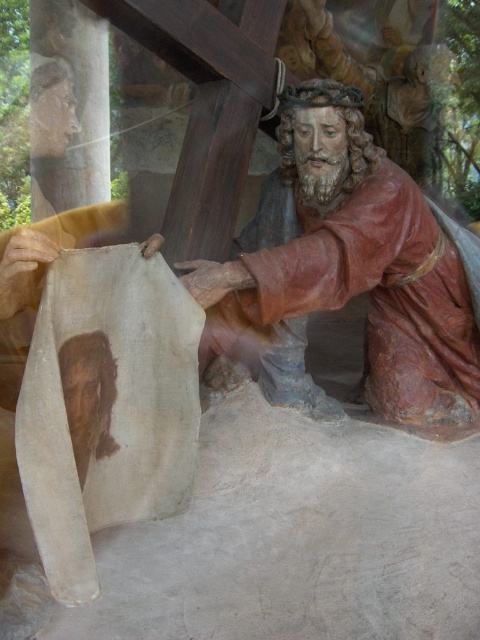
You are an art conservator examining a religious statue. You notice the wooden statue at center and the smooth beige cloth at lower left. Which object is closer to you in this arrangement?

The wooden statue at center is closer to you than the smooth beige cloth at lower left.

You are standing 2 meters away from the statue of Jesus Christ in the image. There is a point at coordinates point (x=418, y=371) that you want to touch. Can you reach it without moving closer?

The distance of point (x=418, y=371) from viewer is 2.14 meters, so you are currently 2 meters away. Since 2.14 meters is farther than 2 meters, you cannot reach the point without moving closer.

You are an art restorer examining a religious artwork. You need to determine which object is taller between the wooden statue at center and the smooth beige cloth at lower left. Based on the scene description, which one is taller?

The wooden statue at center is taller than the smooth beige cloth at lower left according to the description.